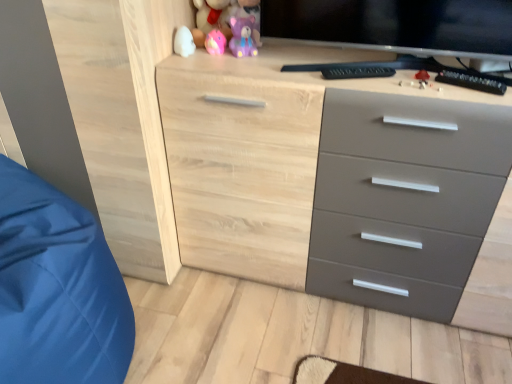
Question: Does white glossy egg at upper left, positioned as the 4th toy in top-to-bottom order, have a lesser height compared to natural wood chest of drawers at center?

Choices:
 (A) yes
 (B) no

Answer: (A)

Question: From a real-world perspective, is white glossy egg at upper left, positioned as the 4th toy in top-to-bottom order, physically below natural wood chest of drawers at center?

Choices:
 (A) no
 (B) yes

Answer: (A)

Question: Is white glossy egg at upper left, positioned as the 4th toy in top-to-bottom order, bigger than natural wood chest of drawers at center?

Choices:
 (A) yes
 (B) no

Answer: (B)

Question: From a real-world perspective, is white glossy egg at upper left, positioned as the 4th toy in top-to-bottom order, positioned over natural wood chest of drawers at center based on gravity?

Choices:
 (A) yes
 (B) no

Answer: (A)

Question: Is white glossy egg at upper left, the first toy when ordered from bottom to top, aimed at natural wood chest of drawers at center?

Choices:
 (A) yes
 (B) no

Answer: (B)

Question: Is white glossy egg at upper left, the first toy when ordered from bottom to top, taller than natural wood chest of drawers at center?

Choices:
 (A) yes
 (B) no

Answer: (B)

Question: Are pink plush bear at upper center, the fourth toy from the bottom, and pink rubber duck at upper center, the 2th toy from the top, located far from each other?

Choices:
 (A) no
 (B) yes

Answer: (A)

Question: Does pink plush bear at upper center, the first toy in the top-to-bottom sequence, have a lesser height compared to pink rubber duck at upper center, the 2th toy from the top?

Choices:
 (A) yes
 (B) no

Answer: (B)

Question: From the image's perspective, is pink plush bear at upper center, the first toy in the top-to-bottom sequence, located beneath pink rubber duck at upper center, the 2th toy from the top?

Choices:
 (A) yes
 (B) no

Answer: (B)

Question: Can pink rubber duck at upper center, the 2th toy from the top, be found inside pink plush bear at upper center, the first toy in the top-to-bottom sequence?

Choices:
 (A) yes
 (B) no

Answer: (B)

Question: Considering the relative positions of pink plush bear at upper center, the first toy in the top-to-bottom sequence, and pink rubber duck at upper center, marked as the third toy in a bottom-to-top arrangement, in the image provided, is pink plush bear at upper center, the first toy in the top-to-bottom sequence, to the left of pink rubber duck at upper center, marked as the third toy in a bottom-to-top arrangement, from the viewer's perspective?

Choices:
 (A) yes
 (B) no

Answer: (B)

Question: Is pink plush bear at upper center, the first toy in the top-to-bottom sequence, positioned behind pink rubber duck at upper center, the 2th toy from the top?

Choices:
 (A) yes
 (B) no

Answer: (B)

Question: Does natural wood chest of drawers at center have a lesser width compared to pink rubber duck at upper center, marked as the third toy in a bottom-to-top arrangement?

Choices:
 (A) yes
 (B) no

Answer: (B)